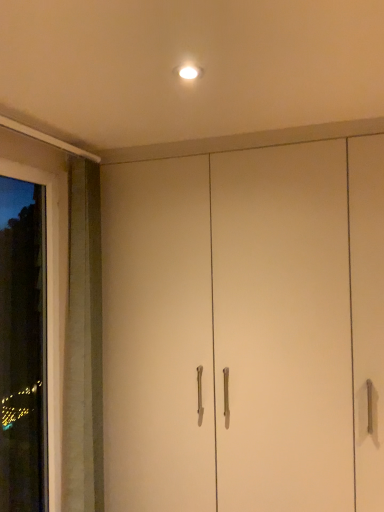
Locate an element on the screen. This screenshot has width=384, height=512. transparent glass window at left is located at coordinates (23, 348).

What is the approximate height of transparent glass window at left?

The height of transparent glass window at left is 1.55 meters.

Measure the distance between transparent glass window at left and camera.

6.53 feet.

This screenshot has height=512, width=384. Describe the element at coordinates (23, 348) in the screenshot. I see `transparent glass window at left` at that location.

Where is `transparent glass window at left`? The width and height of the screenshot is (384, 512). transparent glass window at left is located at coordinates (23, 348).